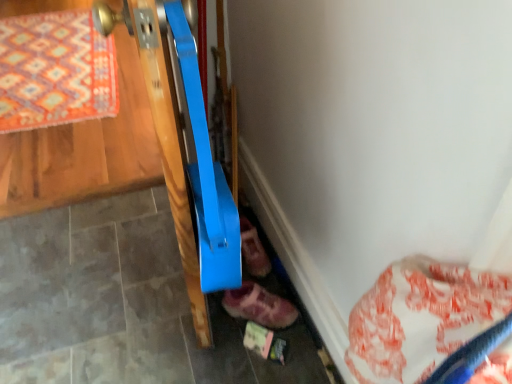
Image resolution: width=512 pixels, height=384 pixels. Describe the element at coordinates (259, 306) in the screenshot. I see `leather suede shoe at lower center, arranged as the first footwear when viewed from the front` at that location.

What do you see at coordinates (55, 71) in the screenshot? The image size is (512, 384). I see `orange patterned rug at upper left` at bounding box center [55, 71].

The height and width of the screenshot is (384, 512). What do you see at coordinates (253, 250) in the screenshot?
I see `leather pink shoe at lower center, which is the first footwear in back-to-front order` at bounding box center [253, 250].

In order to click on leather pink shoe at lower center, which is the first footwear in back-to-front order in this screenshot , I will do `click(253, 250)`.

You are a GUI agent. You are given a task and a screenshot of the screen. Output one action in this format:
    pyautogui.click(x=<x>, y=<y>)
    Task: Click on the leather suede shoe at lower center, acting as the 2th footwear starting from the back
    This screenshot has width=512, height=384.
    Given the screenshot: What is the action you would take?
    pyautogui.click(x=259, y=306)

Which is correct: leather pink shoe at lower center, which is the first footwear in back-to-front order, is inside leather suede shoe at lower center, arranged as the first footwear when viewed from the front, or outside of it?

leather pink shoe at lower center, which is the first footwear in back-to-front order, is not inside leather suede shoe at lower center, arranged as the first footwear when viewed from the front, it's outside.

Is leather pink shoe at lower center, which is the first footwear in back-to-front order, facing towards leather suede shoe at lower center, arranged as the first footwear when viewed from the front?

Yes.

Considering the sizes of objects leather pink shoe at lower center, which is the first footwear in back-to-front order, and leather suede shoe at lower center, arranged as the first footwear when viewed from the front, in the image provided, who is thinner, leather pink shoe at lower center, which is the first footwear in back-to-front order, or leather suede shoe at lower center, arranged as the first footwear when viewed from the front,?

With smaller width is leather pink shoe at lower center, which is the first footwear in back-to-front order.

Which object is further away from the camera, leather pink shoe at lower center, which is the first footwear in back-to-front order, or leather suede shoe at lower center, acting as the 2th footwear starting from the back?

leather pink shoe at lower center, which is the first footwear in back-to-front order.

Is orange patterned rug at upper left spatially inside leather pink shoe at lower center, which is the first footwear in back-to-front order, or outside of it?

orange patterned rug at upper left lies outside leather pink shoe at lower center, which is the first footwear in back-to-front order.

How different are the orientations of orange patterned rug at upper left and leather pink shoe at lower center, acting as the 2th footwear starting from the front, in degrees?

orange patterned rug at upper left and leather pink shoe at lower center, acting as the 2th footwear starting from the front, are facing 16.4 degrees away from each other.

In the image, there is a leather pink shoe at lower center, acting as the 2th footwear starting from the front. Where is `mat below it (from a real-world perspective)`? This screenshot has width=512, height=384. mat below it (from a real-world perspective) is located at coordinates (55, 71).

From the image's perspective, is orange patterned rug at upper left located above or below leather pink shoe at lower center, which is the first footwear in back-to-front order?

Clearly, from the image's perspective, orange patterned rug at upper left is above leather pink shoe at lower center, which is the first footwear in back-to-front order.

Looking at the image, does leather suede shoe at lower center, acting as the 2th footwear starting from the back, seem bigger or smaller compared to leather pink shoe at lower center, which is the first footwear in back-to-front order?

leather suede shoe at lower center, acting as the 2th footwear starting from the back, is bigger than leather pink shoe at lower center, which is the first footwear in back-to-front order.

At what (x,y) coordinates should I click in order to perform the action: click on footwear on the right side of leather pink shoe at lower center, which is the first footwear in back-to-front order. Please return your answer as a coordinate pair (x, y). The image size is (512, 384). Looking at the image, I should click on (259, 306).

Is leather suede shoe at lower center, arranged as the first footwear when viewed from the front, touching leather pink shoe at lower center, which is the first footwear in back-to-front order?

leather suede shoe at lower center, arranged as the first footwear when viewed from the front, is not next to leather pink shoe at lower center, which is the first footwear in back-to-front order, and they're not touching.

From the image's perspective, is leather suede shoe at lower center, acting as the 2th footwear starting from the back, beneath leather pink shoe at lower center, which is the first footwear in back-to-front order?

Yes, from the image's perspective, leather suede shoe at lower center, acting as the 2th footwear starting from the back, is beneath leather pink shoe at lower center, which is the first footwear in back-to-front order.

From a real-world perspective, which object stands above the other?

leather suede shoe at lower center, acting as the 2th footwear starting from the back.

Is leather suede shoe at lower center, arranged as the first footwear when viewed from the front, at the left side of orange patterned rug at upper left?

No, leather suede shoe at lower center, arranged as the first footwear when viewed from the front, is not to the left of orange patterned rug at upper left.

Does leather suede shoe at lower center, arranged as the first footwear when viewed from the front, have a greater height compared to orange patterned rug at upper left?

Indeed, leather suede shoe at lower center, arranged as the first footwear when viewed from the front, has a greater height compared to orange patterned rug at upper left.

Which is correct: leather suede shoe at lower center, acting as the 2th footwear starting from the back, is inside orange patterned rug at upper left, or outside of it?

leather suede shoe at lower center, acting as the 2th footwear starting from the back, is outside orange patterned rug at upper left.

Choose the correct answer: Is orange patterned rug at upper left inside leather suede shoe at lower center, acting as the 2th footwear starting from the back, or outside it?

orange patterned rug at upper left is not enclosed by leather suede shoe at lower center, acting as the 2th footwear starting from the back.

From the picture: Which is further, (69, 24) or (246, 313)?

The point (69, 24) is farther from the camera.

In terms of size, does orange patterned rug at upper left appear bigger or smaller than leather suede shoe at lower center, arranged as the first footwear when viewed from the front?

Clearly, orange patterned rug at upper left is larger in size than leather suede shoe at lower center, arranged as the first footwear when viewed from the front.

From a real-world perspective, who is located higher, leather pink shoe at lower center, acting as the 2th footwear starting from the front, or orange patterned rug at upper left?

leather pink shoe at lower center, acting as the 2th footwear starting from the front, is physically above.

Where is `mat lying on the left of leather pink shoe at lower center, which is the first footwear in back-to-front order`? mat lying on the left of leather pink shoe at lower center, which is the first footwear in back-to-front order is located at coordinates (55, 71).

Is there a large distance between leather pink shoe at lower center, which is the first footwear in back-to-front order, and orange patterned rug at upper left?

leather pink shoe at lower center, which is the first footwear in back-to-front order, is far away from orange patterned rug at upper left.

Could you measure the distance between leather pink shoe at lower center, which is the first footwear in back-to-front order, and orange patterned rug at upper left?

leather pink shoe at lower center, which is the first footwear in back-to-front order, and orange patterned rug at upper left are 5.11 feet apart from each other.

Locate an element on the screen. footwear that is on the right side of leather pink shoe at lower center, which is the first footwear in back-to-front order is located at coordinates (259, 306).

In order to click on mat on the left of leather pink shoe at lower center, which is the first footwear in back-to-front order in this screenshot , I will do `click(55, 71)`.

From the picture: Estimate the real-world distances between objects in this image. Which object is closer to leather suede shoe at lower center, arranged as the first footwear when viewed from the front, orange patterned rug at upper left or leather pink shoe at lower center, acting as the 2th footwear starting from the front?

leather pink shoe at lower center, acting as the 2th footwear starting from the front, lies closer to leather suede shoe at lower center, arranged as the first footwear when viewed from the front, than the other object.

Estimate the real-world distances between objects in this image. Which object is closer to leather pink shoe at lower center, which is the first footwear in back-to-front order, orange patterned rug at upper left or leather suede shoe at lower center, acting as the 2th footwear starting from the back?

leather suede shoe at lower center, acting as the 2th footwear starting from the back.

From the image, which object appears to be farther from leather suede shoe at lower center, arranged as the first footwear when viewed from the front, leather pink shoe at lower center, acting as the 2th footwear starting from the front, or orange patterned rug at upper left?

orange patterned rug at upper left lies further to leather suede shoe at lower center, arranged as the first footwear when viewed from the front, than the other object.

Estimate the real-world distances between objects in this image. Which object is further from orange patterned rug at upper left, leather pink shoe at lower center, which is the first footwear in back-to-front order, or leather suede shoe at lower center, acting as the 2th footwear starting from the back?

The object further to orange patterned rug at upper left is leather suede shoe at lower center, acting as the 2th footwear starting from the back.

Looking at the image, which one is located closer to orange patterned rug at upper left, leather suede shoe at lower center, arranged as the first footwear when viewed from the front, or leather pink shoe at lower center, acting as the 2th footwear starting from the front?

leather pink shoe at lower center, acting as the 2th footwear starting from the front.

Considering their positions, is leather suede shoe at lower center, arranged as the first footwear when viewed from the front, positioned further to leather pink shoe at lower center, which is the first footwear in back-to-front order, than orange patterned rug at upper left?

orange patterned rug at upper left is further to leather pink shoe at lower center, which is the first footwear in back-to-front order.

I want to click on footwear between orange patterned rug at upper left and leather suede shoe at lower center, acting as the 2th footwear starting from the back, from left to right, so click(x=253, y=250).